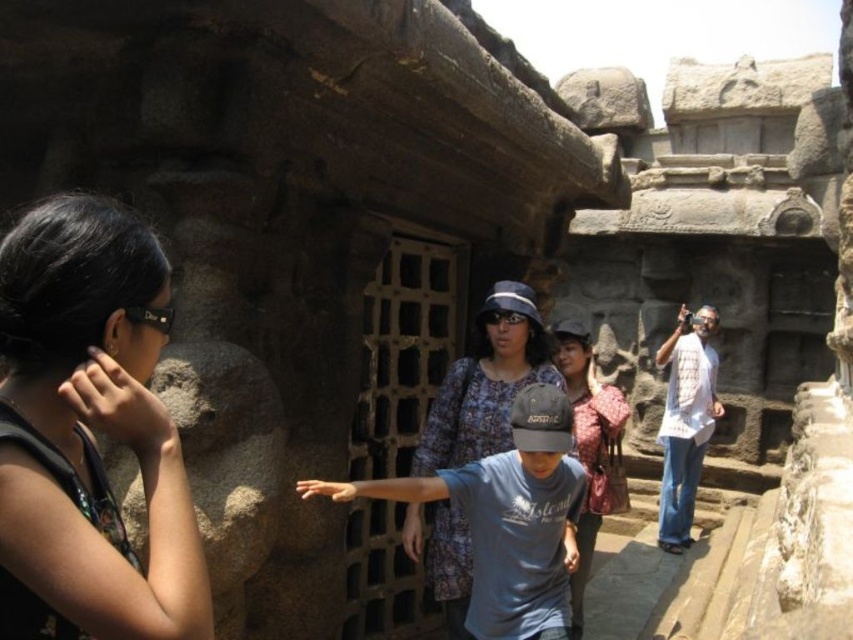
You are a tour guide at the archaeological site and need to arrange a group photo. You have two shirts available for the visitors to wear for the photo session. The white woven shirt at right and the blue denim shirt at center. Which shirt would be more suitable for a visitor with a broader build to ensure a better fit?

The blue denim shirt at center is more suitable for a visitor with a broader build because it has a greater width than the white woven shirt at right.

You are a photographer trying to capture the entire scene in one shot. Given that the printed fabric dress at center and the white woven shirt at right are both in the frame, which one should you focus on to ensure the other fits better in the composition?

The printed fabric dress at center occupies less space than the white woven shirt at right, so focusing on the white woven shirt at right will allow the smaller printed fabric dress at center to fit better within the composition.

Looking at this image, you are standing at point (83, 268) and want to reach the temple entrance which is 100.55 feet away. If your walking speed is 3 feet per second, how many seconds will it take you to reach the entrance?

It will take approximately 33.5 seconds to reach the temple entrance since 100.55 divided by 3 equals approximately 33.5 seconds.